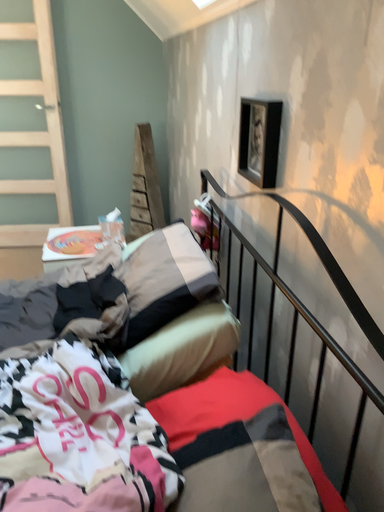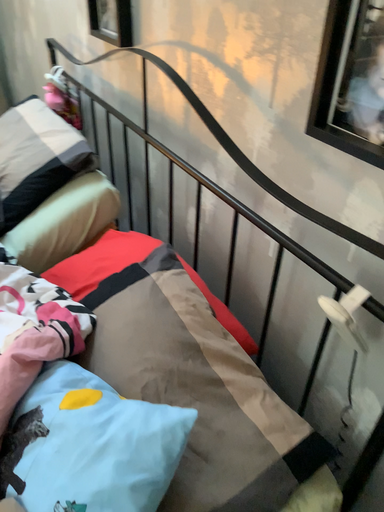
Question: Which way did the camera rotate in the video?

Choices:
 (A) rotated upward
 (B) rotated downward

Answer: (B)